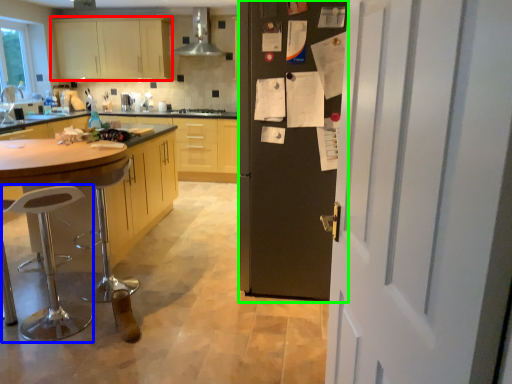
Question: Considering the real-world distances, which object is closest to cabinetry (highlighted by a red box)? bar stool (highlighted by a blue box) or fridge (highlighted by a green box).

Choices:
 (A) bar stool
 (B) fridge

Answer: (A)